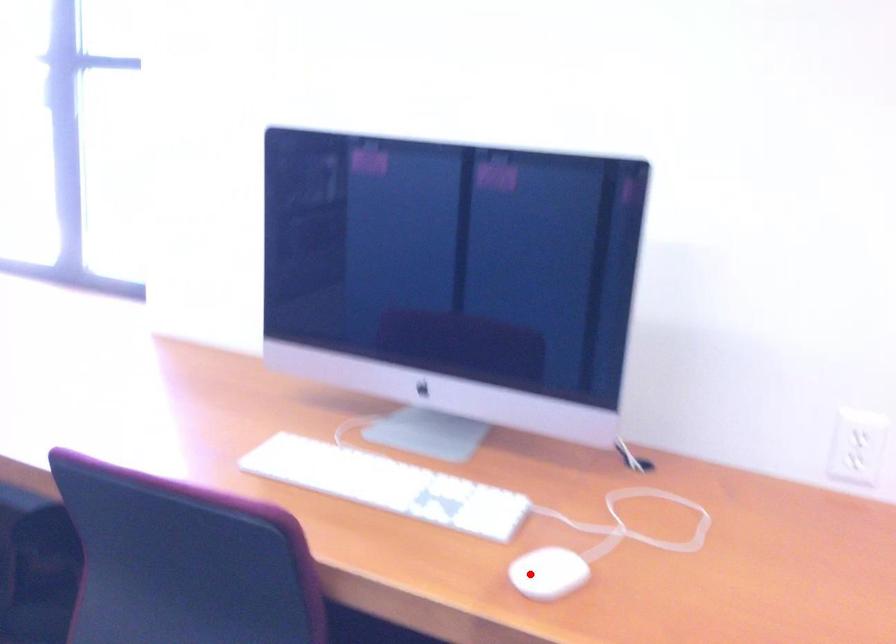
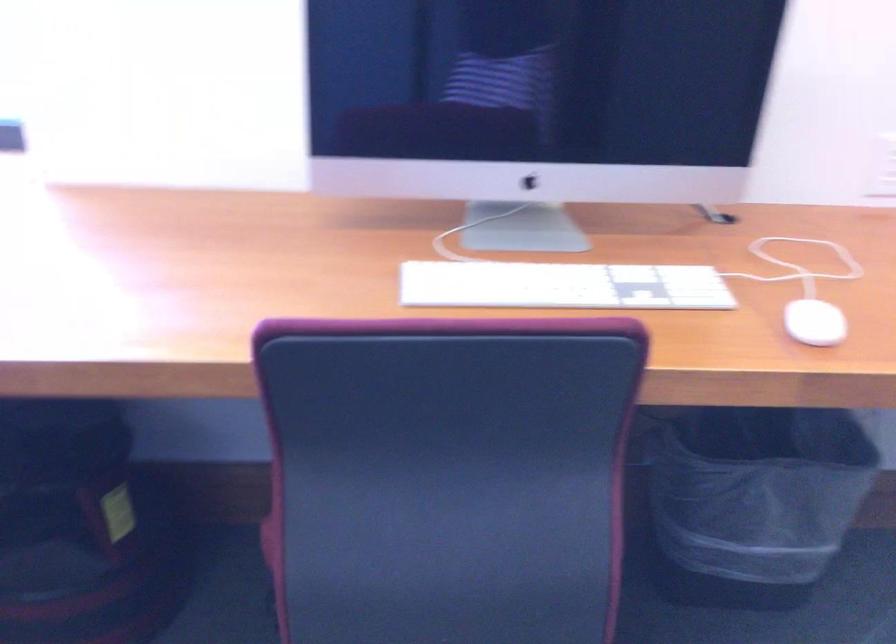
Find the pixel in the second image that matches the highlighted location in the first image.

(814, 323)